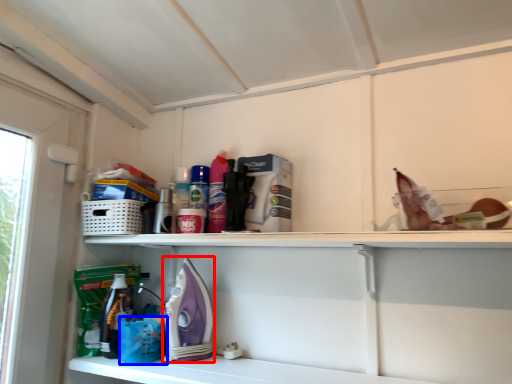
Question: Which point is further to the camera, appliance (highlighted by a red box) or basket (highlighted by a blue box)?

Choices:
 (A) appliance
 (B) basket

Answer: (B)